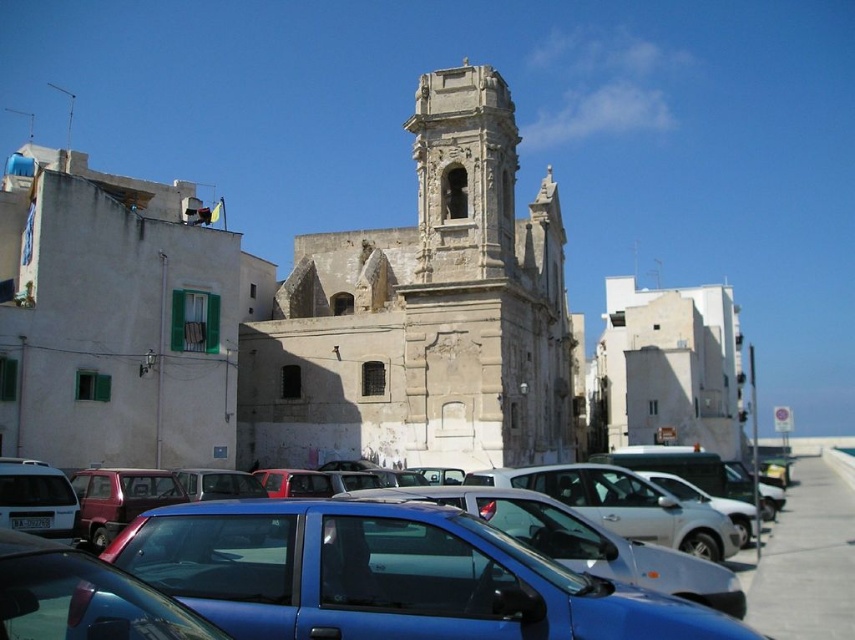
Question: Is metallic blue sedan at center below white concrete building at center?

Choices:
 (A) yes
 (B) no

Answer: (A)

Question: Does metallic blue sedan at center appear under white concrete building at center?

Choices:
 (A) yes
 (B) no

Answer: (A)

Question: Is white stone church at center bigger than metallic blue sedan at center?

Choices:
 (A) no
 (B) yes

Answer: (B)

Question: Among these objects, which one is nearest to the camera?

Choices:
 (A) white stone church at center
 (B) metallic blue sedan at center

Answer: (B)

Question: Based on their relative distances, which object is farther from the white concrete building at center?

Choices:
 (A) metallic blue sedan at center
 (B) white stone church at center

Answer: (A)

Question: Which point is closer to the camera?

Choices:
 (A) white concrete building at center
 (B) white stone church at center

Answer: (B)